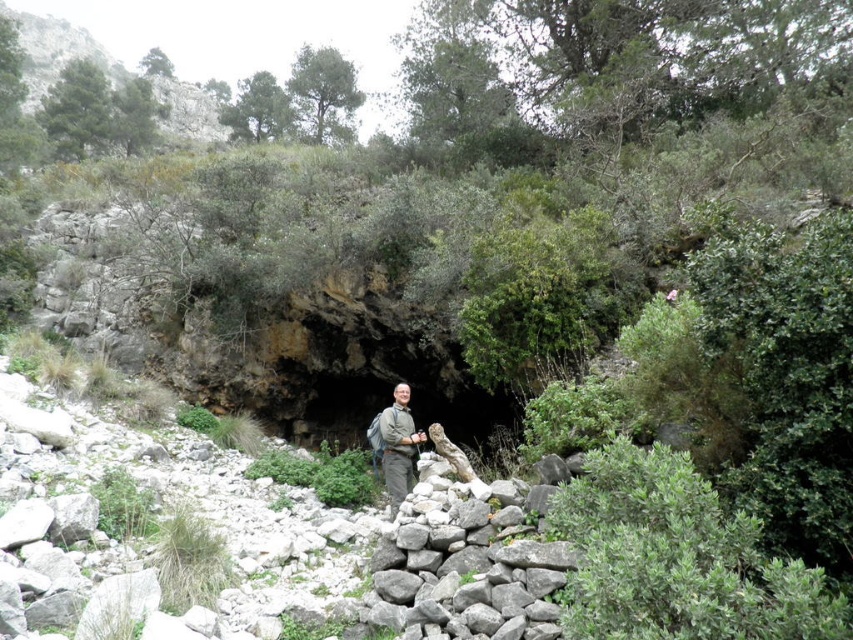
Does gray rough stone at center have a greater width compared to khaki fabric jacket at center?

Correct, the width of gray rough stone at center exceeds that of khaki fabric jacket at center.

Is gray rough stone at center thinner than khaki fabric jacket at center?

Incorrect, gray rough stone at center's width is not less than khaki fabric jacket at center's.

Locate an element on the screen. gray rough stone at center is located at coordinates (465, 568).